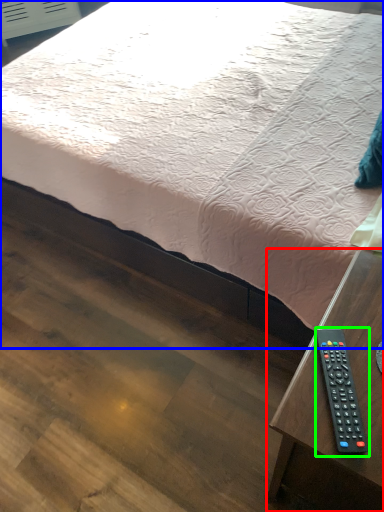
Question: Based on their relative distances, which object is farther from table (highlighted by a red box)? Choose from bed (highlighted by a blue box) and remote control (highlighted by a green box).

Choices:
 (A) bed
 (B) remote control

Answer: (A)